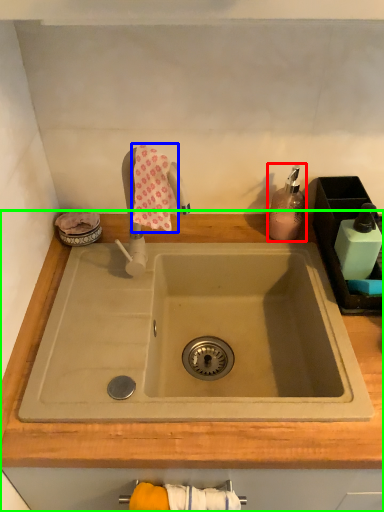
Question: Considering the real-world distances, which object is closest to soap dispenser (highlighted by a red box)? bath towel (highlighted by a blue box) or countertop (highlighted by a green box).

Choices:
 (A) bath towel
 (B) countertop

Answer: (B)